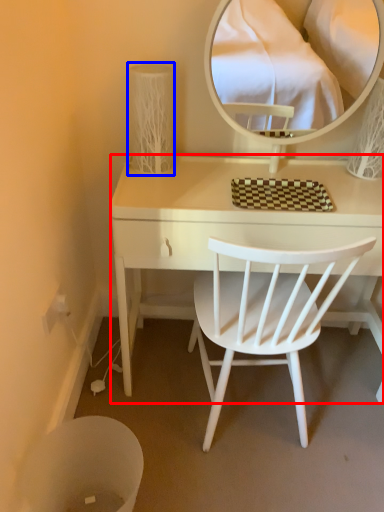
Question: Which object appears closest to the camera in this image, desk (highlighted by a red box) or table lamp (highlighted by a blue box)?

Choices:
 (A) desk
 (B) table lamp

Answer: (A)